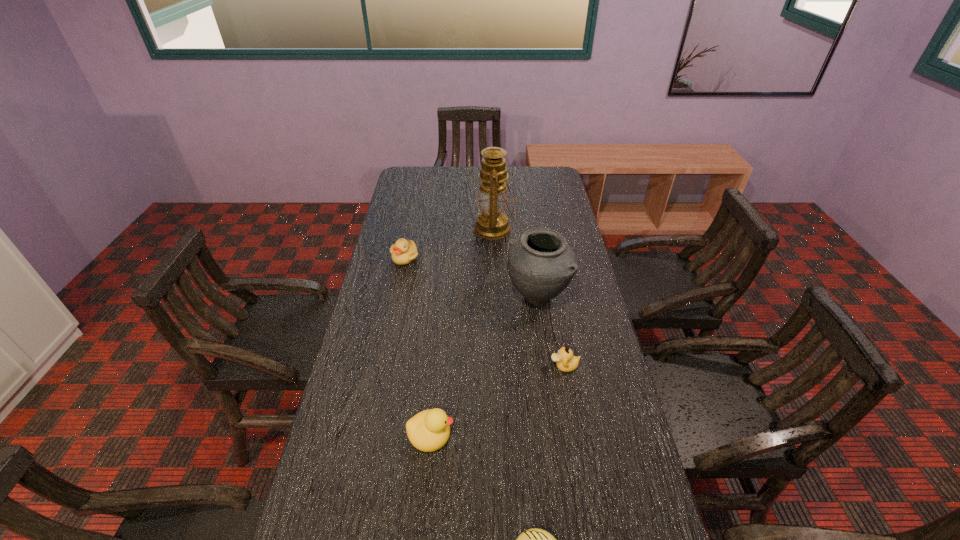
Image resolution: width=960 pixels, height=540 pixels. I want to click on vacant region at the far edge of the desktop, so click(x=444, y=177).

In the image, there is a desktop. Where is `vacant area at the left edge`? vacant area at the left edge is located at coordinates (354, 508).

In the image, there is a desktop. Identify the location of vacant space at the right edge. This screenshot has height=540, width=960. (562, 225).

The image size is (960, 540). Find the location of `unoccupied position between the tallest object and the second farthest object`. unoccupied position between the tallest object and the second farthest object is located at coordinates (449, 244).

Where is `free space between the farthest object and the farthest duckling`? This screenshot has width=960, height=540. free space between the farthest object and the farthest duckling is located at coordinates click(x=449, y=244).

This screenshot has height=540, width=960. Identify the location of vacant space in between the second object from left to right and the leftmost duckling. (418, 346).

Find the location of `empty location between the rightmost duckling and the leftmost object`. empty location between the rightmost duckling and the leftmost object is located at coordinates (485, 312).

The width and height of the screenshot is (960, 540). I want to click on free point between the second object from left to right and the urn, so click(484, 365).

Select which object appears as the fourth closest to the second object from left to right. Please provide its 2D coordinates. Your answer should be formatted as a tuple, i.e. [(x, y)], where the tuple contains the x and y coordinates of a point satisfying the conditions above.

[(404, 252)]

Locate which object ranks fourth in proximity to the nearest object. Please provide its 2D coordinates. Your answer should be formatted as a tuple, i.e. [(x, y)], where the tuple contains the x and y coordinates of a point satisfying the conditions above.

[(404, 252)]